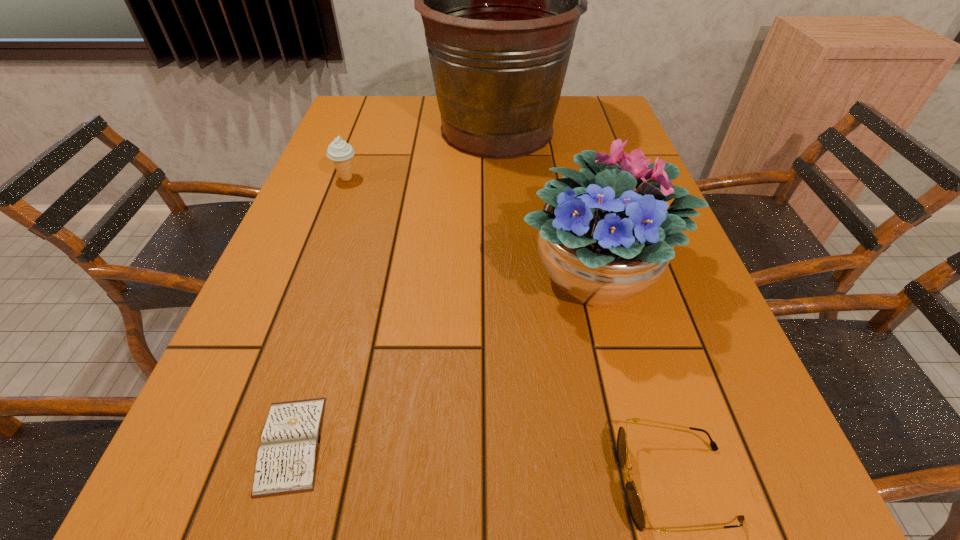
Locate an element on the screen. This screenshot has width=960, height=540. vacant area situated on the back of the diary is located at coordinates (336, 295).

What are the coordinates of `object that is at the far edge` in the screenshot? It's located at (500, 0).

You are a GUI agent. You are given a task and a screenshot of the screen. Output one action in this format:
    pyautogui.click(x=<x>, y=<y>)
    Task: Click on the object positioned at the near edge
    Image resolution: width=960 pixels, height=540 pixels.
    Given the screenshot: What is the action you would take?
    pyautogui.click(x=286, y=462)

Identify the location of icecream that is at the left edge. This screenshot has width=960, height=540. (340, 152).

This screenshot has width=960, height=540. I want to click on diary present at the left edge, so click(x=286, y=462).

Where is `object that is at the right edge`? The image size is (960, 540). object that is at the right edge is located at coordinates (603, 243).

Identify the location of object located at the near left corner. (286, 462).

Where is `vacant space at the far edge`? Image resolution: width=960 pixels, height=540 pixels. vacant space at the far edge is located at coordinates (560, 117).

This screenshot has height=540, width=960. In the image, there is a desktop. What are the coordinates of `vacant space at the left edge` in the screenshot? It's located at (273, 315).

Where is `vacant space at the right edge of the desktop`? Image resolution: width=960 pixels, height=540 pixels. vacant space at the right edge of the desktop is located at coordinates (668, 323).